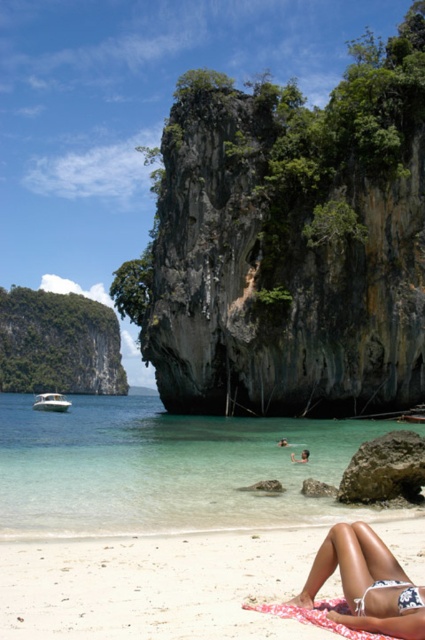
Question: Is white sandy beach at lower center to the right of white fabric bikini top at lower right from the viewer's perspective?

Choices:
 (A) yes
 (B) no

Answer: (B)

Question: Does white fabric bikini top at lower right lie behind white glossy boat at left?

Choices:
 (A) yes
 (B) no

Answer: (B)

Question: Which point is closer to the camera taking this photo?

Choices:
 (A) (163, 524)
 (B) (56, 404)
 (C) (391, 600)
 (D) (385, 582)

Answer: (C)

Question: Which point is closer to the camera?

Choices:
 (A) clear water at center
 (B) white fabric bikini top at lower right

Answer: (B)

Question: Is clear water at center smaller than tan skin bikini at lower right?

Choices:
 (A) no
 (B) yes

Answer: (A)

Question: Which point is farther to the camera?

Choices:
 (A) (186, 483)
 (B) (407, 604)
 (C) (362, 609)
 (D) (39, 404)

Answer: (D)